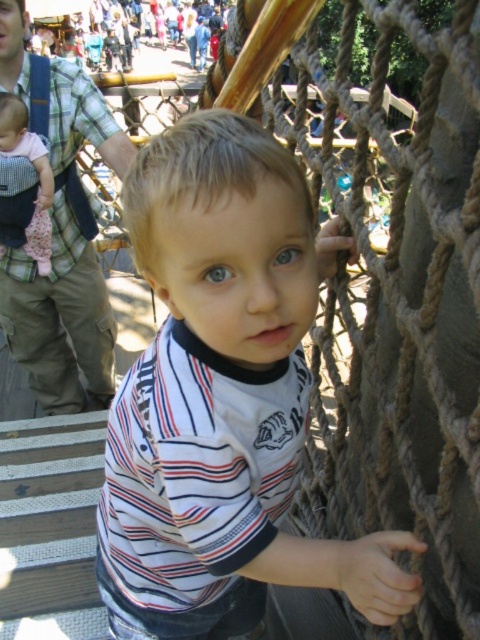
Question: Is white striped shirt at center to the right of matte black baby carrier at left from the viewer's perspective?

Choices:
 (A) yes
 (B) no

Answer: (A)

Question: Does white striped shirt at center have a smaller size compared to matte black baby carrier at left?

Choices:
 (A) yes
 (B) no

Answer: (B)

Question: Does white striped shirt at center appear on the right side of matte black baby carrier at left?

Choices:
 (A) yes
 (B) no

Answer: (A)

Question: Which object appears closest to the camera in this image?

Choices:
 (A) white striped shirt at center
 (B) matte black baby carrier at left

Answer: (A)